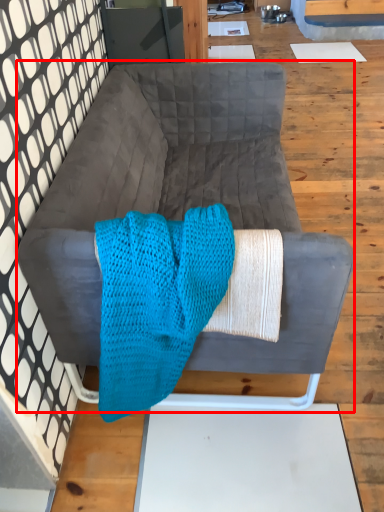
Question: From the image, what is the correct spatial relationship of studio couch (annotated by the red box) in relation to blanket?

Choices:
 (A) left
 (B) right

Answer: (B)